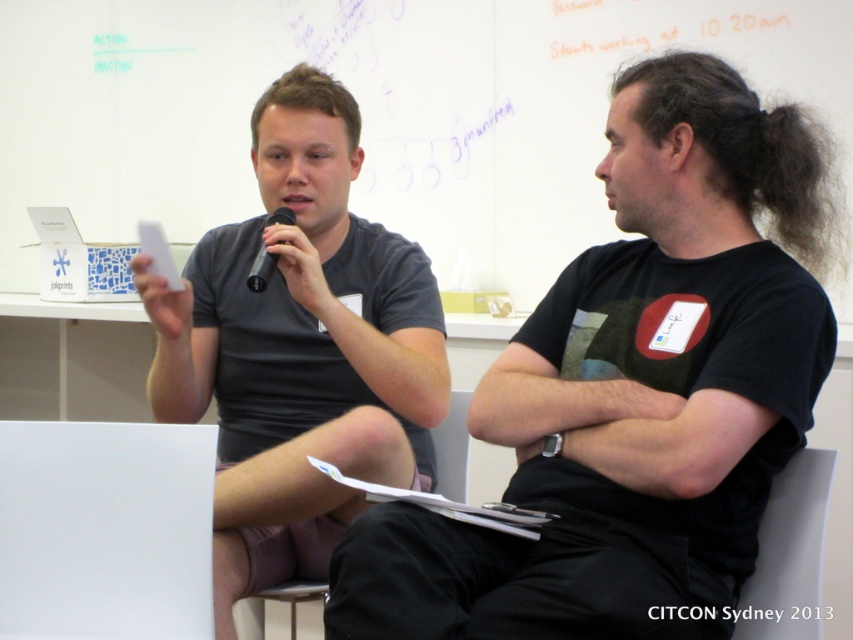
Question: Which point is closer to the camera?

Choices:
 (A) (111, 579)
 (B) (283, 208)
 (C) (672, 282)
 (D) (190, 294)

Answer: (C)

Question: Does matte gray t-shirt at center have a smaller size compared to black plastic microphone at upper center?

Choices:
 (A) no
 (B) yes

Answer: (A)

Question: Which point appears closest to the camera in this image?

Choices:
 (A) (741, 620)
 (B) (291, 225)
 (C) (128, 461)

Answer: (A)

Question: Is white paper at lower left further to camera compared to white paper at upper center?

Choices:
 (A) no
 (B) yes

Answer: (B)

Question: Among these objects, which one is nearest to the camera?

Choices:
 (A) matte gray t-shirt at center
 (B) black plastic microphone at upper center

Answer: (A)

Question: In this image, where is white paper at lower left located relative to black plastic microphone at upper center?

Choices:
 (A) below
 (B) above

Answer: (A)